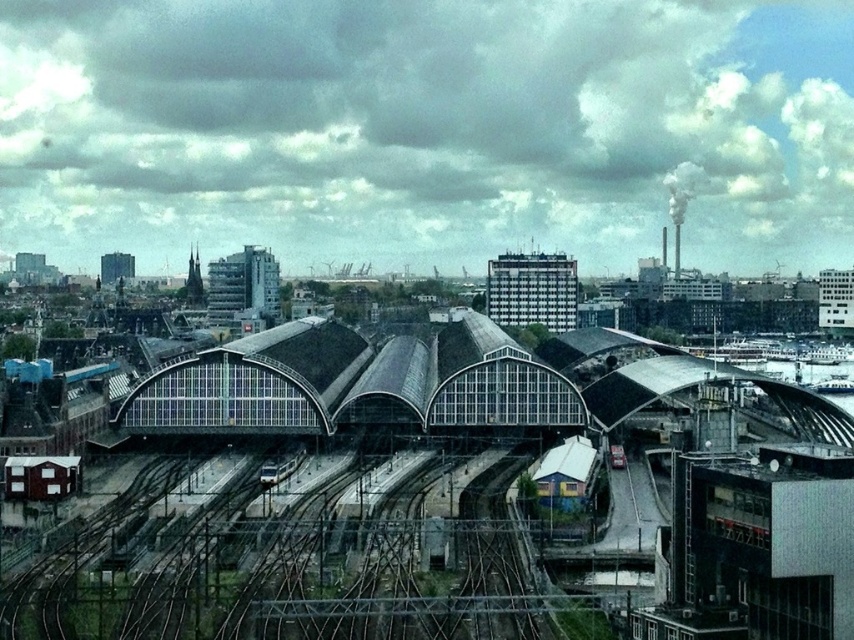
You are a maintenance worker needing to place a 3 meter wide equipment on the metallic gray train tracks at center. Can you confirm if the tracks are wide enough to accommodate the equipment without overlapping the silver metallic train at center?

The metallic gray train tracks at center are wider than the silver metallic train at center, so placing a 3 meter wide equipment on the tracks should be possible as long as it stays within the tracks width.

You are a maintenance worker needing to repair a section of the metallic gray train tracks at center. You have a tool that can only cover an area up to the size of the silver metallic train at center. Will this tool be sufficient for the repair task?

The metallic gray train tracks at center is larger in size than the silver metallic train at center. Therefore, the tool that can only cover up to the size of the silver metallic train at center will not be sufficient for the repair task.

You are a maintenance worker at the station and need to locate the metallic gray train tracks at center. According to the coordinates provided, where would you find them?

The metallic gray train tracks at center are located at point [291,563].